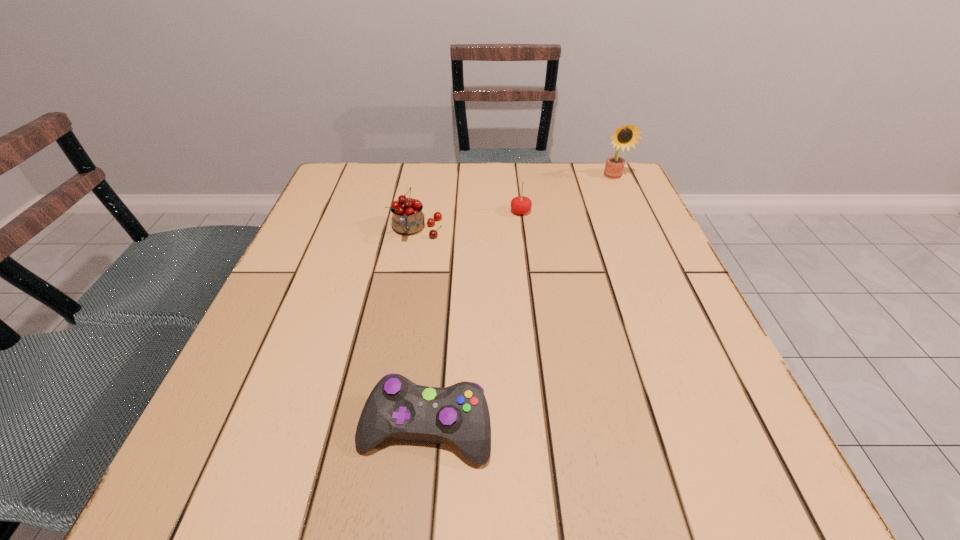
Locate an element on the screen. The height and width of the screenshot is (540, 960). vacant space at the right edge of the desktop is located at coordinates (675, 406).

Identify the location of vacant space at the far left corner. (350, 196).

The width and height of the screenshot is (960, 540). In the image, there is a desktop. Find the location of `vacant space at the far right corner`. vacant space at the far right corner is located at coordinates (605, 201).

The height and width of the screenshot is (540, 960). In order to click on free space at the near right corner in this screenshot , I will do `click(672, 499)`.

At what (x,y) coordinates should I click in order to perform the action: click on free spot between the shorter cherry and the farthest object. Please return your answer as a coordinate pair (x, y). The image size is (960, 540). Looking at the image, I should click on (567, 194).

Locate an element on the screen. This screenshot has height=540, width=960. empty space that is in between the tallest object and the right cherry is located at coordinates pos(567,194).

Identify the location of free space between the shortest object and the right cherry. The image size is (960, 540). (473, 320).

The height and width of the screenshot is (540, 960). I want to click on free space between the rightmost object and the shorter cherry, so click(x=567, y=194).

The width and height of the screenshot is (960, 540). In order to click on blank region between the control and the sunflower in this screenshot , I will do `click(519, 302)`.

The width and height of the screenshot is (960, 540). I want to click on empty space between the tallest object and the shorter cherry, so click(x=567, y=194).